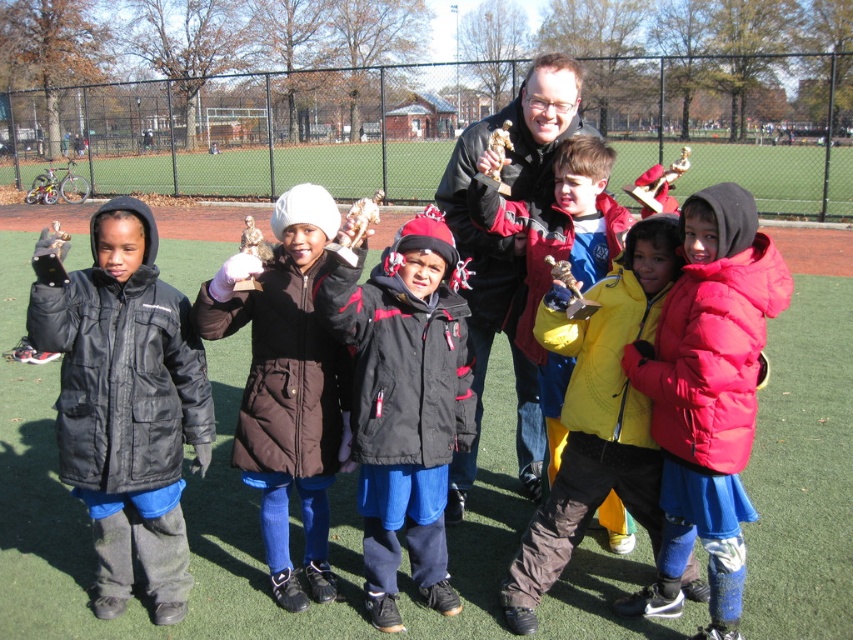
You are a photographer trying to capture a group photo of the children and the adult. You need to ensure that the red puffy jacket at center and the yellow matte jacket at center are both clearly visible in the frame. Given that your camera has a minimum focus distance of 60 centimeters, will you be able to capture both jackets in focus without moving the camera?

The distance between the red puffy jacket at center and the yellow matte jacket at center is 68.46 centimeters. Since your camera requires a minimum focus distance of 60 centimeters, the 68.46 cm distance exceeds this requirement. Therefore, both jackets will be in focus as long as the camera is positioned appropriately to cover both within the frame.

You are a photographer standing at the center of the sports field. You want to take a photo of the red puffy jacket at center. Where should you point your camera?

The red puffy jacket at center is located at the 2D coordinates point (708, 397), so you should point your camera towards that coordinate to capture it.